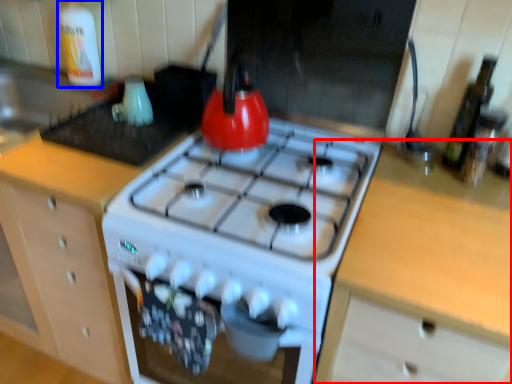
Question: Which object appears closest to the camera in this image, counter (highlighted by a red box) or bottle (highlighted by a blue box)?

Choices:
 (A) counter
 (B) bottle

Answer: (A)